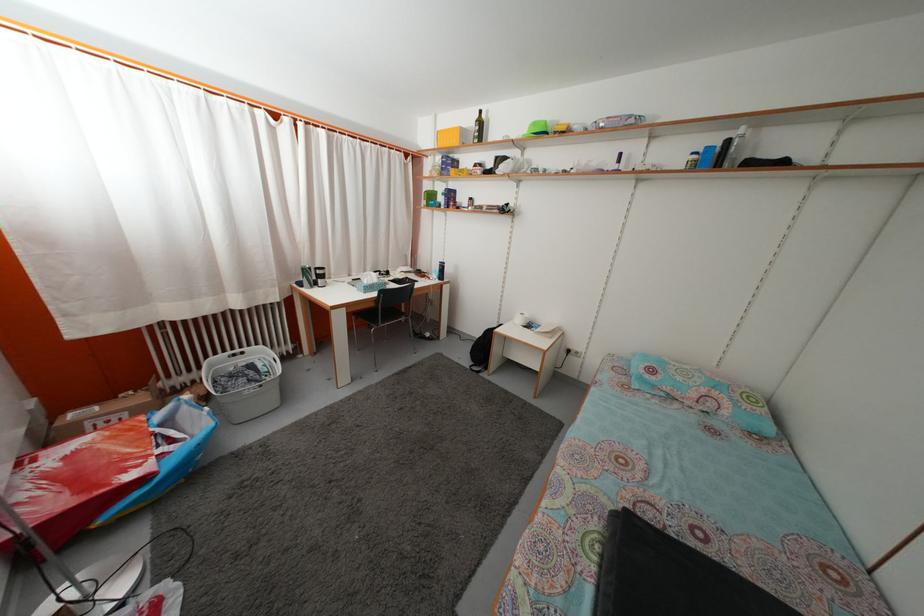
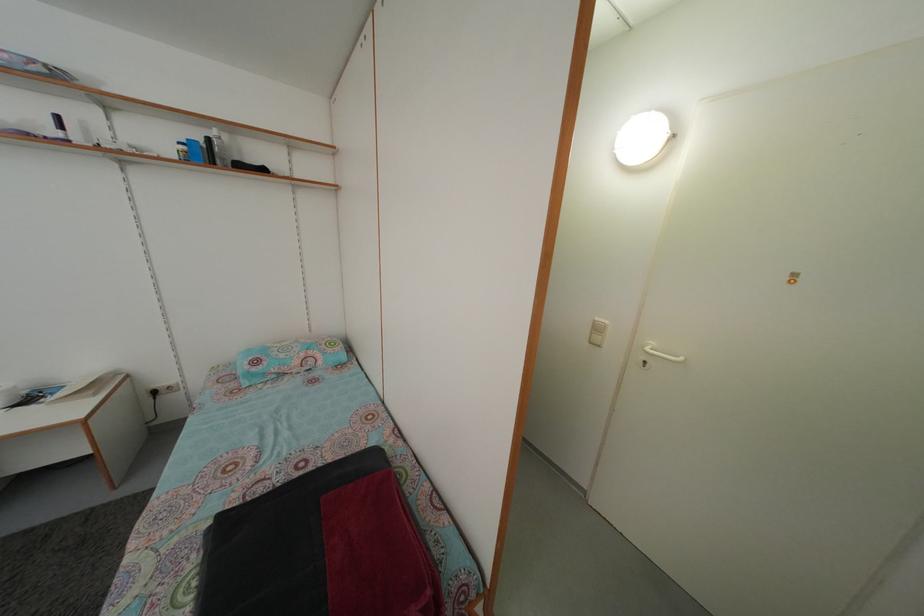
Question: The camera is either moving clockwise (left) or counter-clockwise (right) around the object. The first image is from the beginning of the video and the second image is from the end. Is the camera moving left or right when shooting the video?

Choices:
 (A) Left
 (B) Right

Answer: (A)